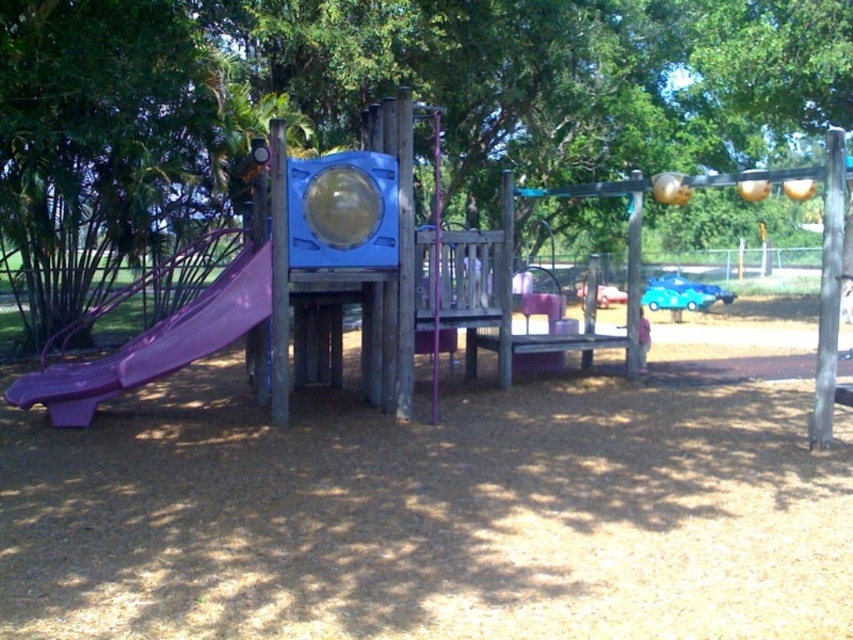
Question: Which object appears farthest from the camera in this image?

Choices:
 (A) purple plastic slide at left
 (B) green leafy tree at upper center
 (C) pink plastic child at center

Answer: (C)

Question: Estimate the real-world distances between objects in this image. Which object is closer to the green leafy tree at upper center?

Choices:
 (A) purple plastic slide at left
 (B) pink plastic child at center

Answer: (A)

Question: Can you confirm if green leafy tree at upper center is positioned to the left of pink plastic child at center?

Choices:
 (A) yes
 (B) no

Answer: (B)

Question: Which point is farther from the camera taking this photo?

Choices:
 (A) (642, 358)
 (B) (245, 282)

Answer: (A)

Question: Can you confirm if purple plastic slide at left is bigger than pink plastic child at center?

Choices:
 (A) no
 (B) yes

Answer: (B)

Question: Does purple plastic slide at left come behind pink plastic child at center?

Choices:
 (A) no
 (B) yes

Answer: (A)